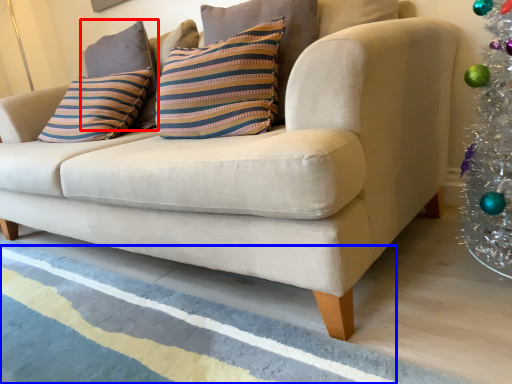
Question: Among these objects, which one is farthest to the camera, pillow (highlighted by a red box) or stripe (highlighted by a blue box)?

Choices:
 (A) pillow
 (B) stripe

Answer: (A)